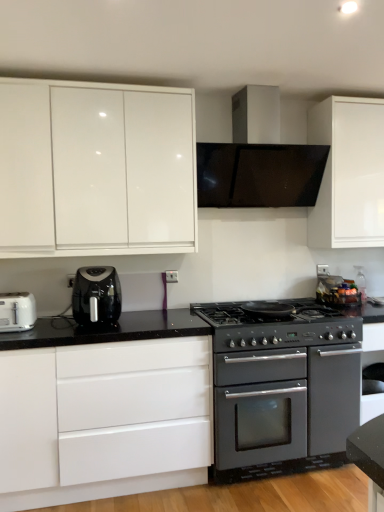
Question: From the image's perspective, does black plastic air fryer at left appear lower than matte black oven at center?

Choices:
 (A) yes
 (B) no

Answer: (B)

Question: Is black plastic air fryer at left taller than matte black oven at center?

Choices:
 (A) yes
 (B) no

Answer: (B)

Question: Can you confirm if black plastic air fryer at left is smaller than matte black oven at center?

Choices:
 (A) yes
 (B) no

Answer: (A)

Question: Is matte black oven at center at the back of black plastic air fryer at left?

Choices:
 (A) yes
 (B) no

Answer: (B)

Question: Is black plastic air fryer at left at the right side of matte black oven at center?

Choices:
 (A) no
 (B) yes

Answer: (A)

Question: Is point (29, 373) positioned closer to the camera than point (345, 385)?

Choices:
 (A) closer
 (B) farther

Answer: (A)

Question: Considering the positions of white glossy cabinet at lower left, the 1th cabinetry from the bottom, and matte black oven at center in the image, is white glossy cabinet at lower left, the 1th cabinetry from the bottom, bigger or smaller than matte black oven at center?

Choices:
 (A) big
 (B) small

Answer: (A)

Question: Visually, is white glossy cabinet at lower left, the 1th cabinetry from the bottom, positioned to the left or to the right of matte black oven at center?

Choices:
 (A) left
 (B) right

Answer: (A)

Question: Do you think white glossy cabinet at lower left, the 1th cabinetry from the bottom, is within matte black oven at center, or outside of it?

Choices:
 (A) outside
 (B) inside

Answer: (A)

Question: From their relative heights in the image, would you say matte black oven at center is taller or shorter than satin silver range hood at upper center?

Choices:
 (A) tall
 (B) short

Answer: (A)

Question: Considering the positions of point (248, 404) and point (230, 147), is point (248, 404) closer or farther from the camera than point (230, 147)?

Choices:
 (A) closer
 (B) farther

Answer: (A)

Question: Considering the positions of matte black oven at center and satin silver range hood at upper center in the image, is matte black oven at center wider or thinner than satin silver range hood at upper center?

Choices:
 (A) thin
 (B) wide

Answer: (B)

Question: From a real-world perspective, is matte black oven at center above or below satin silver range hood at upper center?

Choices:
 (A) below
 (B) above

Answer: (A)

Question: From the image's perspective, is white glossy cabinet at lower left, positioned as the second cabinetry in top-to-bottom order, positioned above or below glossy white cabinet at upper left, which is the first cabinetry in top-to-bottom order?

Choices:
 (A) below
 (B) above

Answer: (A)

Question: Is white glossy cabinet at lower left, positioned as the second cabinetry in top-to-bottom order, wider or thinner than glossy white cabinet at upper left, which is the first cabinetry in top-to-bottom order?

Choices:
 (A) wide
 (B) thin

Answer: (A)